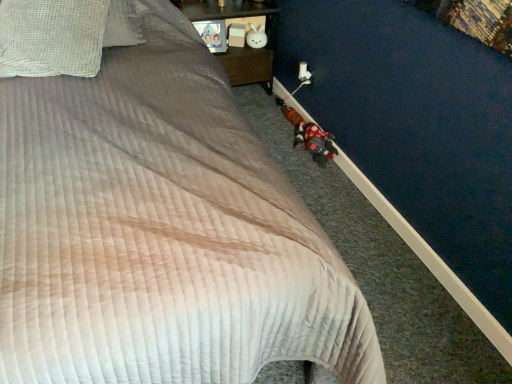
Question: Considering the relative positions of wooden nightstand at upper center and white checkered pillow at upper left in the image provided, is wooden nightstand at upper center to the left or to the right of white checkered pillow at upper left?

Choices:
 (A) left
 (B) right

Answer: (B)

Question: Considering the positions of point (227, 57) and point (54, 34), is point (227, 57) closer or farther from the camera than point (54, 34)?

Choices:
 (A) closer
 (B) farther

Answer: (B)

Question: Considering the real-world distances, which object is farthest from the white matte plush rabbit at upper center, placed as the 2th toy when sorted from bottom to top?

Choices:
 (A) fluffy plush toy at lower right, the first toy viewed from the right
 (B) wooden nightstand at upper center
 (C) white checkered pillow at upper left

Answer: (C)

Question: Considering the real-world distances, which object is farthest from the fluffy plush toy at lower right, arranged as the second toy when viewed from the left?

Choices:
 (A) wooden nightstand at upper center
 (B) white checkered pillow at upper left
 (C) white matte plush rabbit at upper center, which appears as the 2th toy when viewed from the front

Answer: (B)